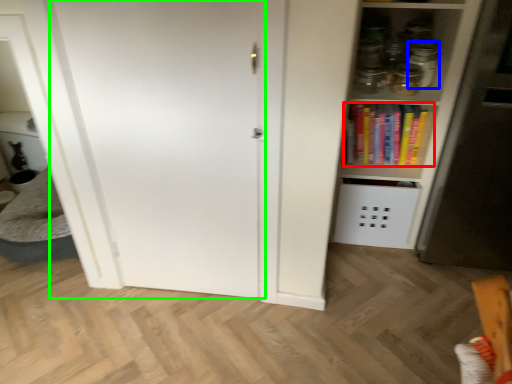
Question: Based on their relative distances, which object is farther from book (highlighted by a red box)? Choose from glass jar (highlighted by a blue box) and door (highlighted by a green box).

Choices:
 (A) glass jar
 (B) door

Answer: (B)